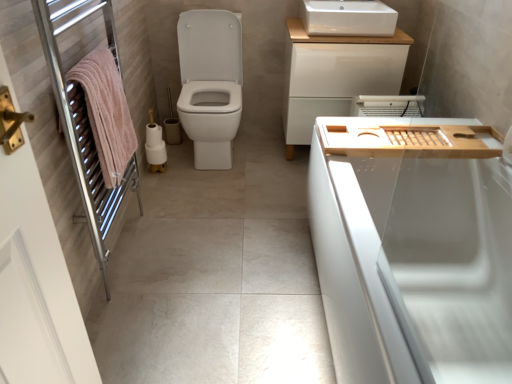
Locate an element on the screen. The width and height of the screenshot is (512, 384). vacant location below pink towel at left (from a real-world perspective) is located at coordinates (119, 249).